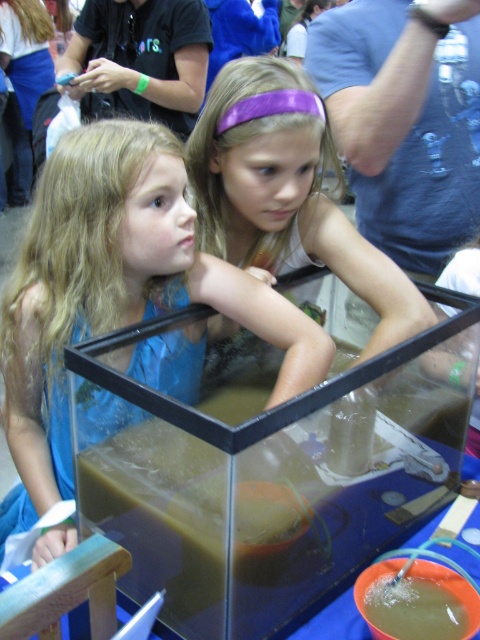
Which of these two, transparent glass tank at center or purple shiny headband at upper center, stands taller?

With more height is purple shiny headband at upper center.

Does transparent glass tank at center lie behind purple shiny headband at upper center?

No, it is in front of purple shiny headband at upper center.

Is point (85, 372) positioned behind point (264, 145)?

No, (85, 372) is closer to viewer.

I want to click on transparent glass tank at center, so click(268, 474).

Can you confirm if blue fabric dress at left is positioned to the left of purple shiny headband at upper center?

Correct, you'll find blue fabric dress at left to the left of purple shiny headband at upper center.

Can you confirm if blue fabric dress at left is positioned below purple shiny headband at upper center?

Yes, blue fabric dress at left is below purple shiny headband at upper center.

The height and width of the screenshot is (640, 480). Identify the location of blue fabric dress at left. (115, 291).

Where is `blue fabric dress at left`? This screenshot has height=640, width=480. blue fabric dress at left is located at coordinates (115, 291).

Is transparent glass tank at center to the right of blue fabric dress at left from the viewer's perspective?

Correct, you'll find transparent glass tank at center to the right of blue fabric dress at left.

Measure the distance between transparent glass tank at center and blue fabric dress at left.

A distance of 6.97 inches exists between transparent glass tank at center and blue fabric dress at left.

What are the coordinates of `transparent glass tank at center` in the screenshot? It's located at (268, 474).